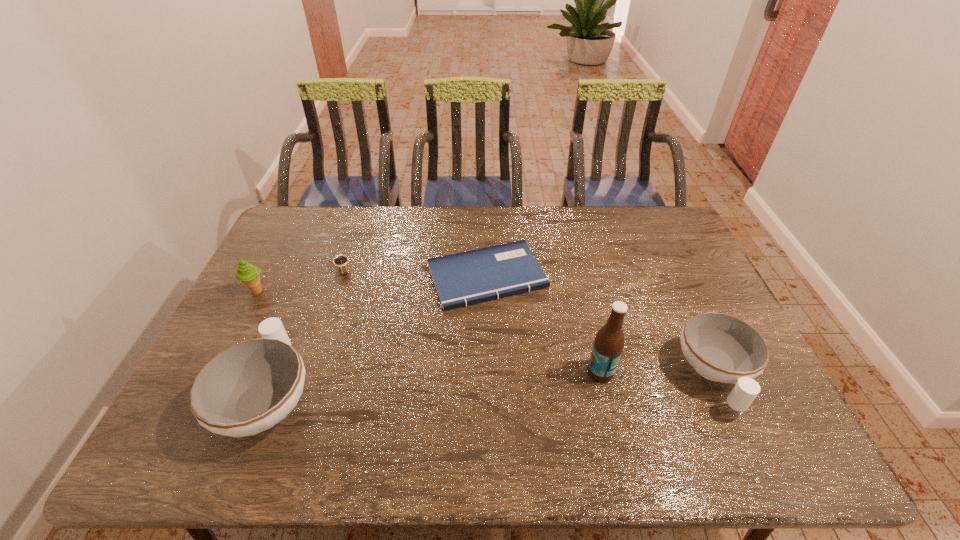
Where is `the left chinaware`? This screenshot has width=960, height=540. the left chinaware is located at coordinates (251, 386).

The height and width of the screenshot is (540, 960). Find the location of `the rightmost object`. the rightmost object is located at coordinates (722, 348).

Image resolution: width=960 pixels, height=540 pixels. I want to click on the shorter chinaware, so click(722, 348).

The image size is (960, 540). In order to click on watch in this screenshot , I will do `click(341, 261)`.

Locate an element on the screen. the leftmost object is located at coordinates (248, 274).

I want to click on the third object from right to left, so 461,279.

Where is `the tallest object`? The image size is (960, 540). the tallest object is located at coordinates (608, 345).

The height and width of the screenshot is (540, 960). What are the coordinates of `the second object from right to left` in the screenshot? It's located at (608, 345).

Where is `free space located on the side with the handle of the taller chinaware`? Image resolution: width=960 pixels, height=540 pixels. free space located on the side with the handle of the taller chinaware is located at coordinates 321,268.

Locate an element on the screen. The height and width of the screenshot is (540, 960). vacant region located 0.340m on the side with the handle of the taller chinaware is located at coordinates (322, 266).